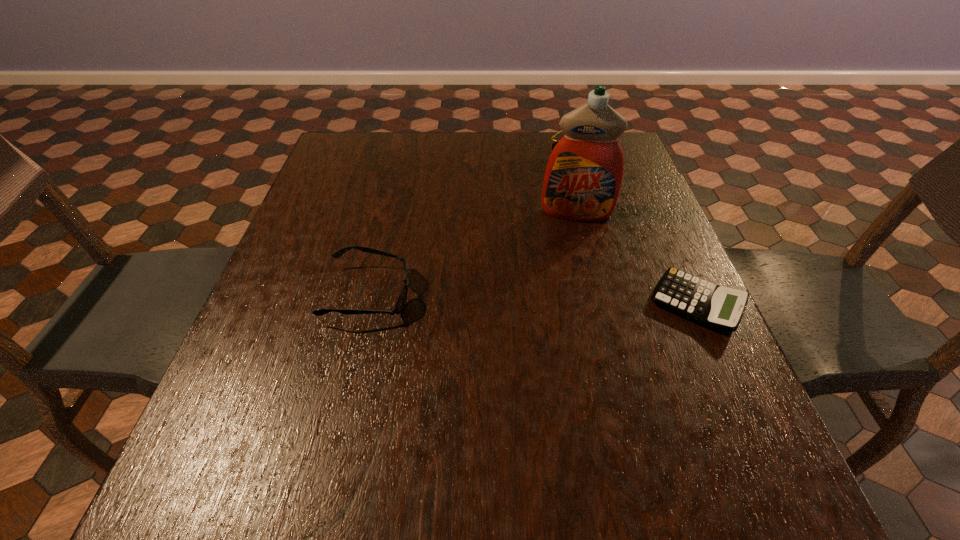
Find the location of a particular element. This screenshot has height=540, width=960. vacant area situated on the front surface of the detergent is located at coordinates (576, 253).

What are the coordinates of `free point located on the front surface of the detergent` in the screenshot? It's located at (577, 300).

The image size is (960, 540). Find the location of `free point located 0.130m on the front-facing side of the farther sunglasses`. free point located 0.130m on the front-facing side of the farther sunglasses is located at coordinates (556, 192).

Where is `free spot located 0.170m on the front-facing side of the farther sunglasses`? This screenshot has height=540, width=960. free spot located 0.170m on the front-facing side of the farther sunglasses is located at coordinates (550, 200).

What are the coordinates of `free location located 0.070m on the front-facing side of the farther sunglasses` in the screenshot? It's located at (564, 181).

The height and width of the screenshot is (540, 960). What are the coordinates of `object positioned at the far edge` in the screenshot? It's located at (553, 145).

I want to click on object situated at the left edge, so coord(402,297).

Locate an element on the screen. The height and width of the screenshot is (540, 960). calculator located in the right edge section of the desktop is located at coordinates (714, 306).

Locate an element on the screen. The width and height of the screenshot is (960, 540). detergent that is at the right edge is located at coordinates coord(583,178).

The height and width of the screenshot is (540, 960). I want to click on sunglasses positioned at the right edge, so click(553, 145).